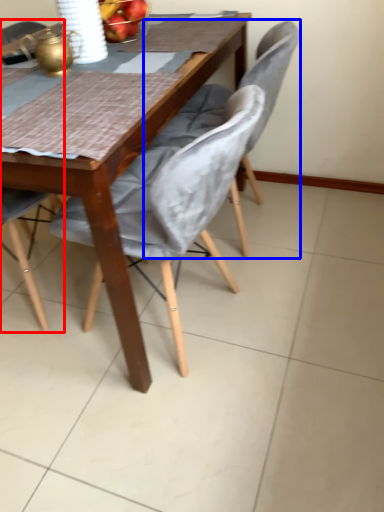
Question: Which object is further to the camera taking this photo, chair (highlighted by a red box) or chair (highlighted by a blue box)?

Choices:
 (A) chair
 (B) chair

Answer: (B)